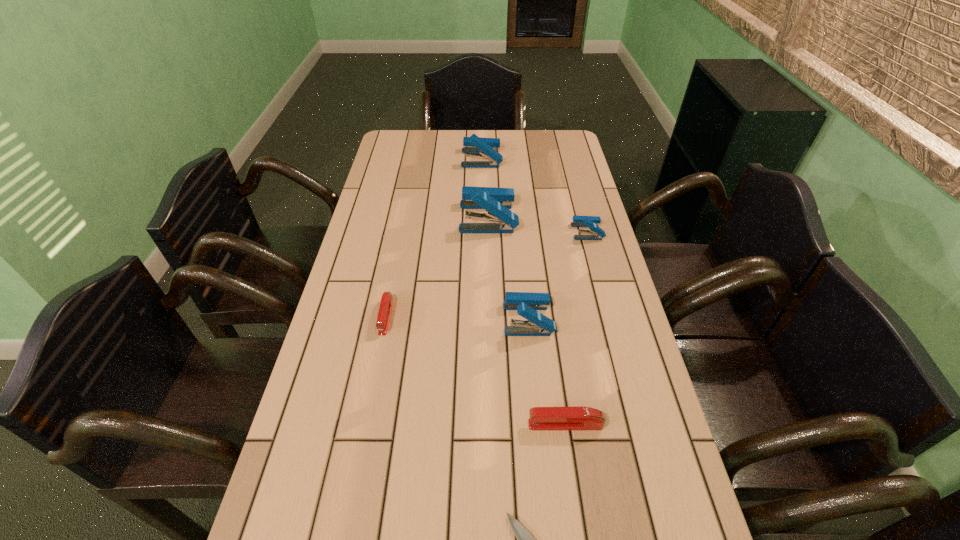
You are a GUI agent. You are given a task and a screenshot of the screen. Output one action in this format:
    pyautogui.click(x=<x>, y=<y>)
    Task: Click on the object that is at the far edge
    
    Given the screenshot: What is the action you would take?
    pyautogui.click(x=476, y=146)

At what (x,y) coordinates should I click in order to perform the action: click on object present at the left edge. Please return your answer as a coordinate pair (x, y). Looking at the image, I should click on (385, 307).

In the image, there is a desktop. Where is `vacant space at the far edge`? This screenshot has height=540, width=960. vacant space at the far edge is located at coordinates (513, 132).

I want to click on free space at the left edge of the desktop, so click(348, 292).

At what (x,y) coordinates should I click in order to perform the action: click on vacant area at the right edge. Please return your answer as a coordinate pair (x, y). Looking at the image, I should click on (612, 305).

In the image, there is a desktop. Where is `free region at the far left corner`? This screenshot has height=540, width=960. free region at the far left corner is located at coordinates (423, 133).

Find the location of a particular element. This screenshot has height=540, width=960. blank space at the far right corner is located at coordinates (570, 160).

This screenshot has height=540, width=960. I want to click on vacant space that is in between the second tallest stapler and the rightmost stapler, so click(x=535, y=195).

Identify the location of free spot between the second smallest blue stapler and the rightmost object. (558, 275).

Find the location of a particular element. The image size is (960, 540). vacant region between the second smallest blue stapler and the smaller red stapler is located at coordinates (457, 318).